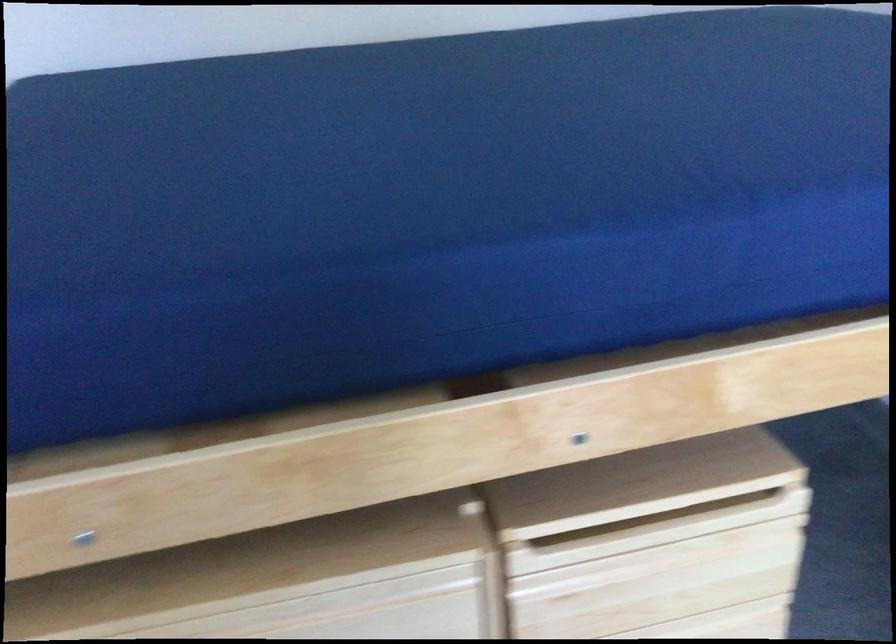
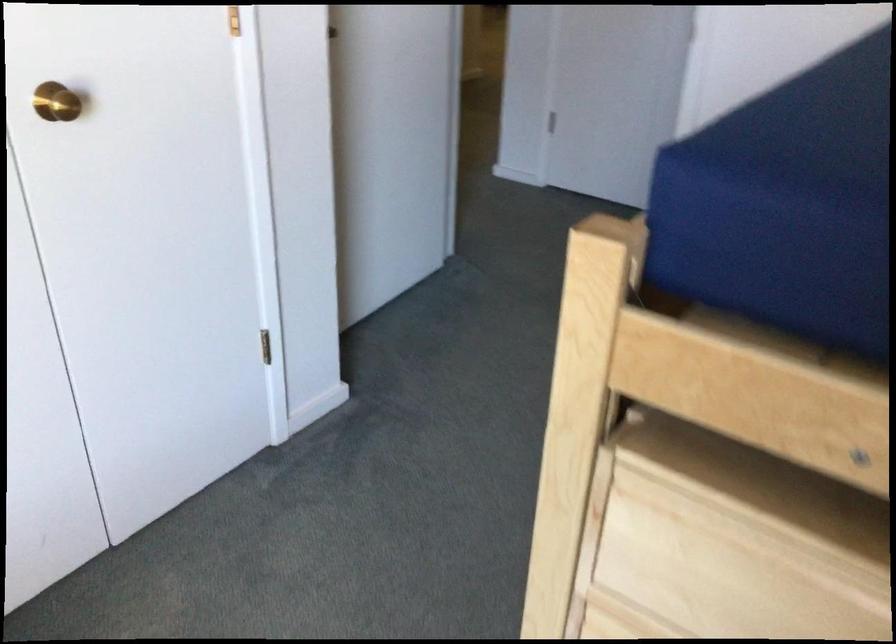
Question: The images are taken continuously from a first-person perspective. In which direction is your viewpoint rotating?

Choices:
 (A) Left
 (B) Right
 (C) Up
 (D) Down

Answer: (A)